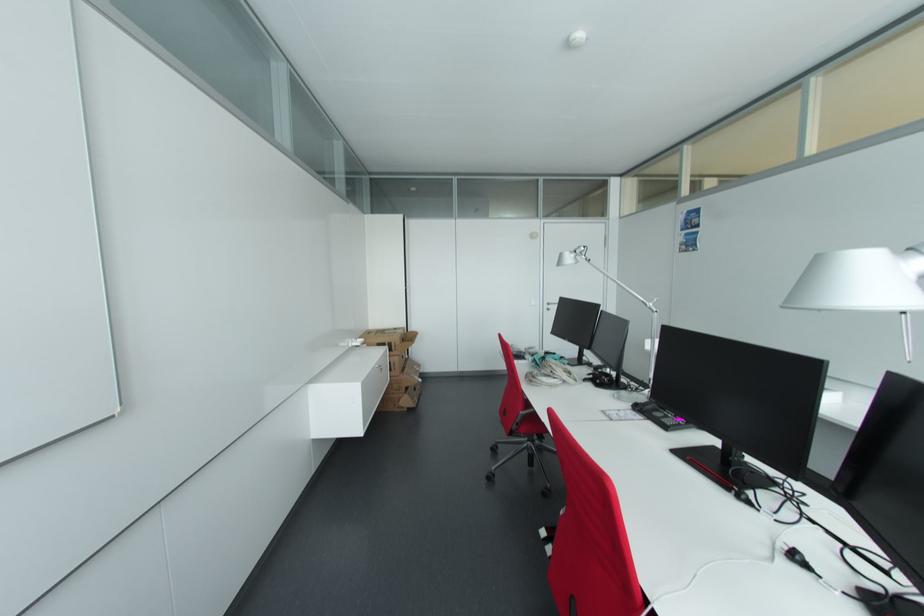
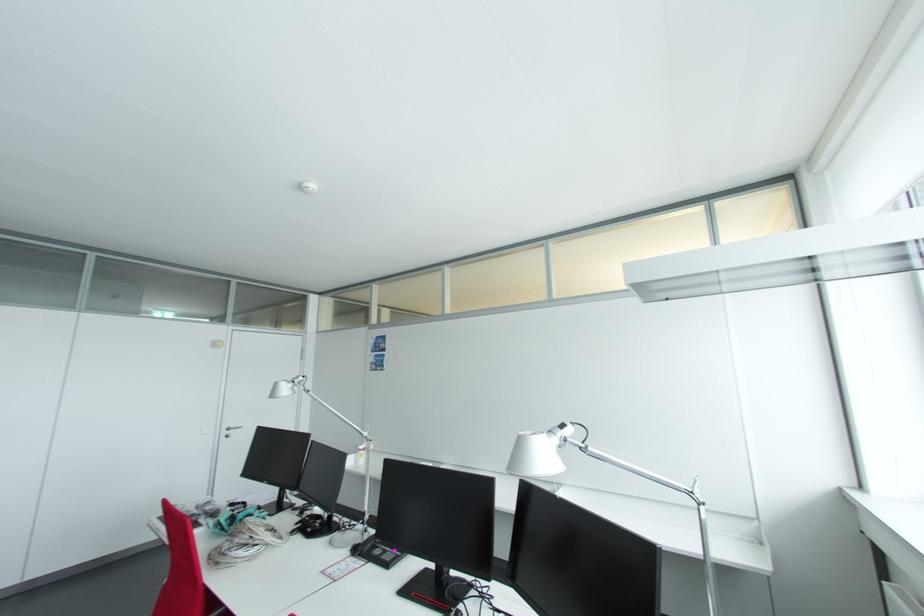
The point at (552, 305) is marked in the first image. Where is the corresponding point in the second image?

(232, 430)